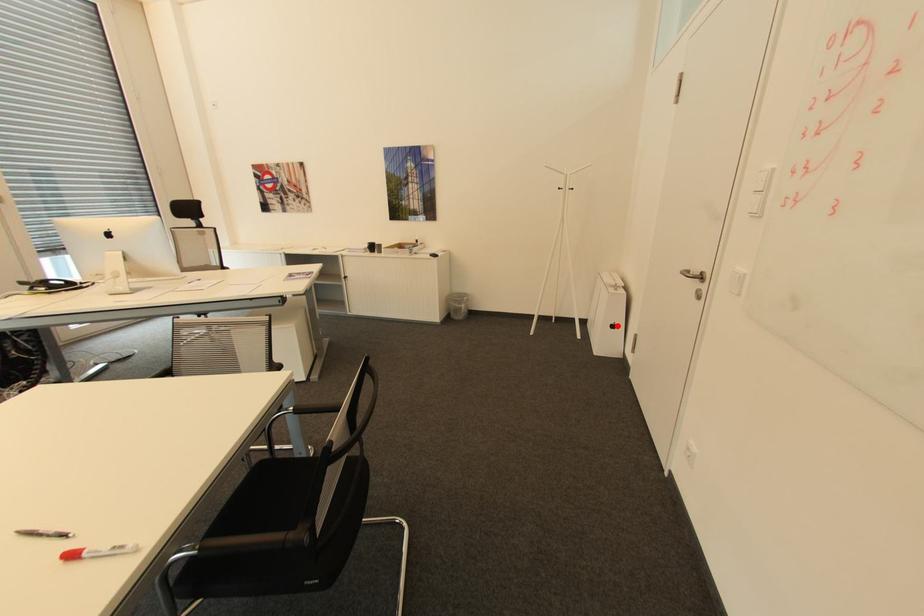
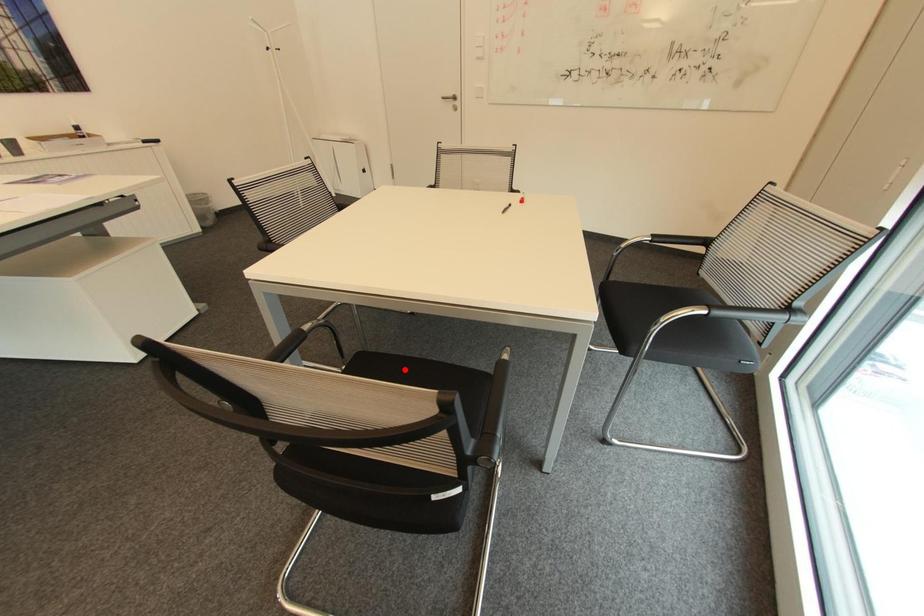
I am providing you with two images of the same scene from different viewpoints. A red point is marked on the first image and another point is marked on the second image. Is the marked point in image1 the same physical position as the marked point in image2?

No